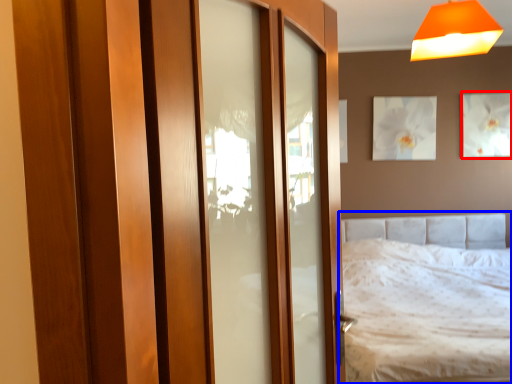
Question: Among these objects, which one is farthest to the camera, picture frame (highlighted by a red box) or bed (highlighted by a blue box)?

Choices:
 (A) picture frame
 (B) bed

Answer: (A)